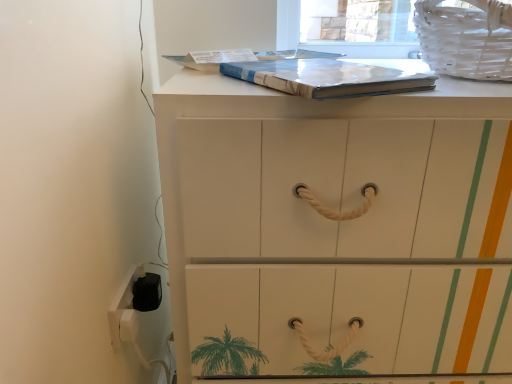
Question: Considering the positions of matte blue paperback book at upper center and white plastic electric outlet at lower left in the image, is matte blue paperback book at upper center bigger or smaller than white plastic electric outlet at lower left?

Choices:
 (A) small
 (B) big

Answer: (B)

Question: Is matte blue paperback book at upper center in front of or behind white plastic electric outlet at lower left in the image?

Choices:
 (A) front
 (B) behind

Answer: (A)

Question: Which of these objects is positioned farthest from the white wicker laundry basket at upper right?

Choices:
 (A) white plastic electric outlet at lower left
 (B) white painted wood chest of drawers at center
 (C) matte blue paperback book at upper center

Answer: (A)

Question: Which object is positioned closest to the matte blue paperback book at upper center?

Choices:
 (A) white wicker laundry basket at upper right
 (B) white plastic electric outlet at lower left
 (C) white painted wood chest of drawers at center

Answer: (A)